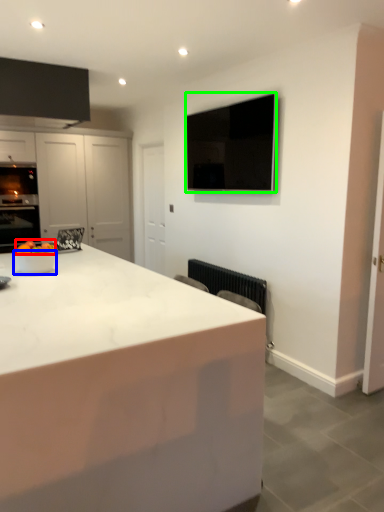
Question: Considering the real-world distances, which object is farthest from fruit (highlighted by a red box)? bowl (highlighted by a blue box) or appliance (highlighted by a green box)?

Choices:
 (A) bowl
 (B) appliance

Answer: (B)